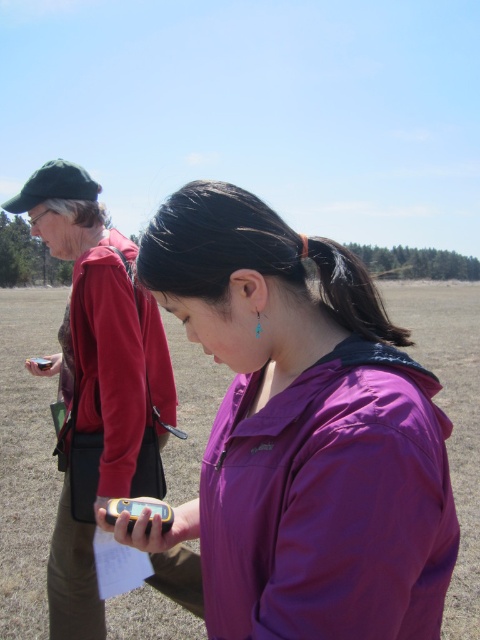
Does point (247, 224) come closer to viewer compared to point (107, 360)?

Yes.

Between point (410, 452) and point (121, 240), which one is positioned behind?

Positioned behind is point (121, 240).

Identify the location of purple fabric jacket at center. (301, 433).

Is matte black gps at left below black silky hair at upper center?

Yes, matte black gps at left is below black silky hair at upper center.

Locate an element on the screen. matte black gps at left is located at coordinates (103, 324).

I want to click on matte black gps at left, so click(x=103, y=324).

Which of these two, matte red jacket at center or black silky hair at upper center, stands shorter?

black silky hair at upper center

Can you confirm if matte red jacket at center is positioned to the left of black silky hair at upper center?

Indeed, matte red jacket at center is positioned on the left side of black silky hair at upper center.

Image resolution: width=480 pixels, height=640 pixels. In order to click on matte red jacket at center in this screenshot , I will do `click(116, 381)`.